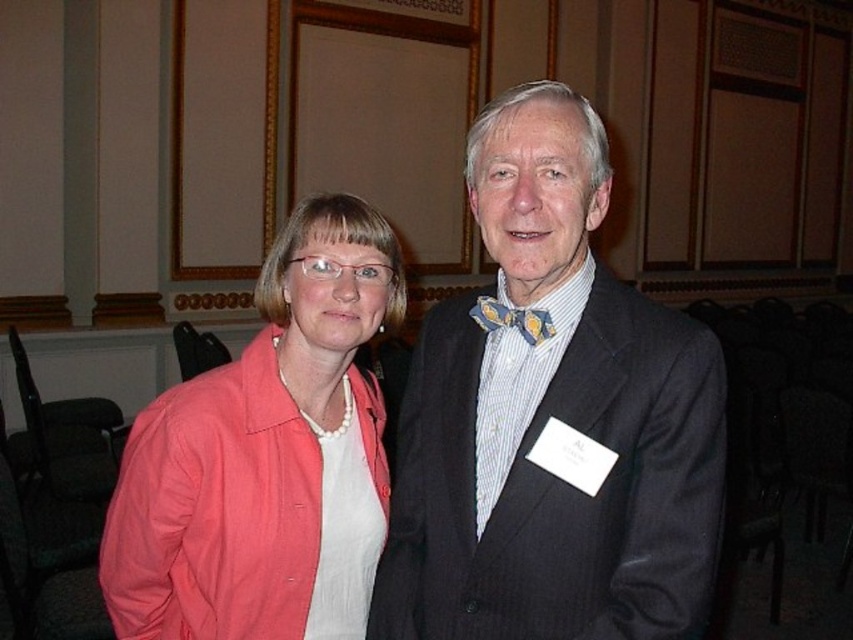
You are organizing a photo shoot and need to arrange two outfits side by side. The matte black suit at center and the coral fabric jacket at left must be placed next to each other. Which outfit takes up more horizontal space?

The coral fabric jacket at left takes up more horizontal space because the matte black suit at center is thinner than it.

You are organizing a photo shoot and need to arrange the matte black suit at center and the coral fabric jacket at left based on their sizes. Which one should you place first if you want to start with the bigger item?

The matte black suit at center is larger in size than the coral fabric jacket at left, so you should place the matte black suit at center first.